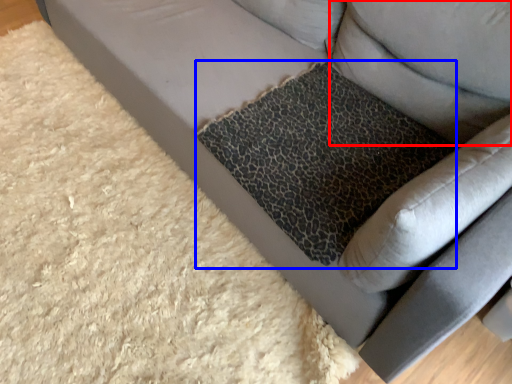
Question: Which point is closer to the camera, pillow (highlighted by a red box) or cat bed (highlighted by a blue box)?

Choices:
 (A) pillow
 (B) cat bed

Answer: (A)